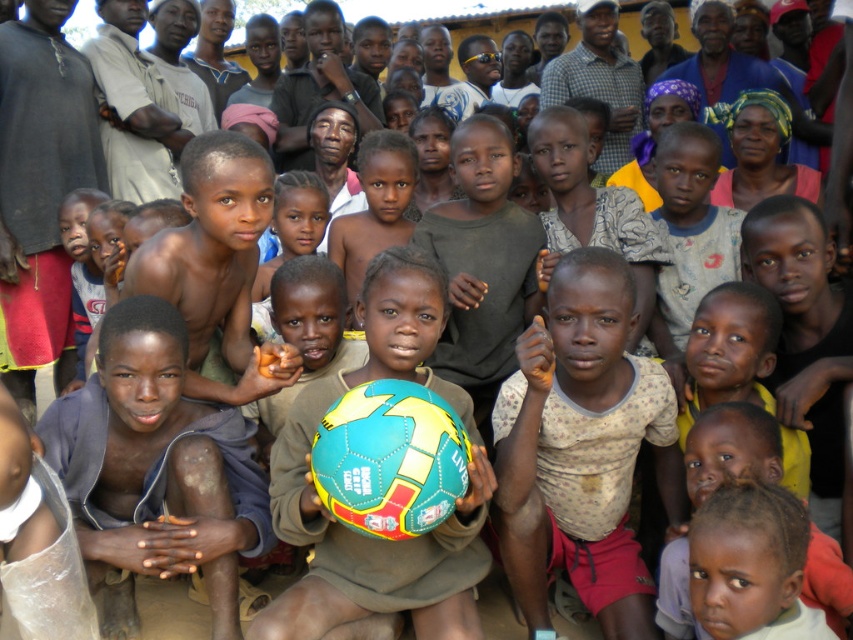
Is brown skin boy at center to the left of multicolored rubber ball at center from the viewer's perspective?

Indeed, brown skin boy at center is positioned on the left side of multicolored rubber ball at center.

Is point (207, 508) positioned in front of point (256, 616)?

No, (207, 508) is behind (256, 616).

Does point (218, 440) lie behind point (363, 592)?

Yes, it is behind point (363, 592).

This screenshot has height=640, width=853. I want to click on brown skin boy at center, so click(157, 465).

Does printed cotton shirt at center appear on the left side of multicolored rubber ball at center?

No, printed cotton shirt at center is not to the left of multicolored rubber ball at center.

This screenshot has height=640, width=853. What are the coordinates of `printed cotton shirt at center` in the screenshot? It's located at pyautogui.click(x=578, y=448).

The image size is (853, 640). I want to click on printed cotton shirt at center, so click(x=578, y=448).

Who is more forward, (x=595, y=518) or (x=167, y=346)?

Point (x=167, y=346) is in front.

The height and width of the screenshot is (640, 853). Identify the location of printed cotton shirt at center. coord(578,448).